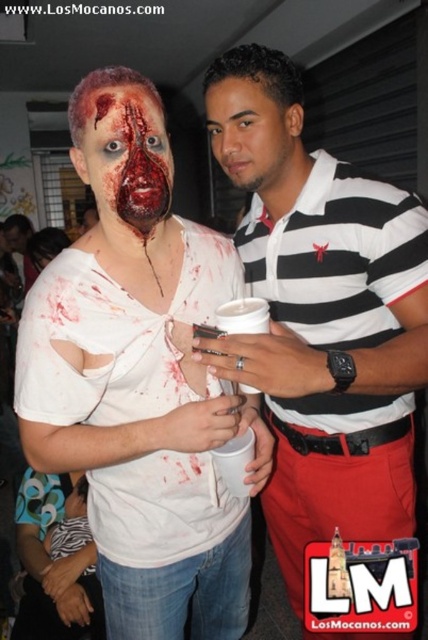
Question: Which object is farther from the camera taking this photo?

Choices:
 (A) matte white shirt at center
 (B) matte flesh-colored makeup at center
 (C) smooth skin face at center

Answer: (C)

Question: Considering the real-world distances, which object is farthest from the striped polo shirt at center?

Choices:
 (A) matte flesh-colored makeup at center
 (B) matte white shirt at center

Answer: (A)

Question: Which object appears closest to the camera in this image?

Choices:
 (A) matte white shirt at center
 (B) smooth skin face at center
 (C) matte flesh-colored makeup at center

Answer: (C)

Question: Does matte white shirt at center appear over matte flesh-colored makeup at center?

Choices:
 (A) no
 (B) yes

Answer: (A)

Question: Is matte white shirt at center bigger than smooth skin face at center?

Choices:
 (A) yes
 (B) no

Answer: (A)

Question: Is matte flesh-colored makeup at center to the right of smooth skin face at center from the viewer's perspective?

Choices:
 (A) yes
 (B) no

Answer: (B)